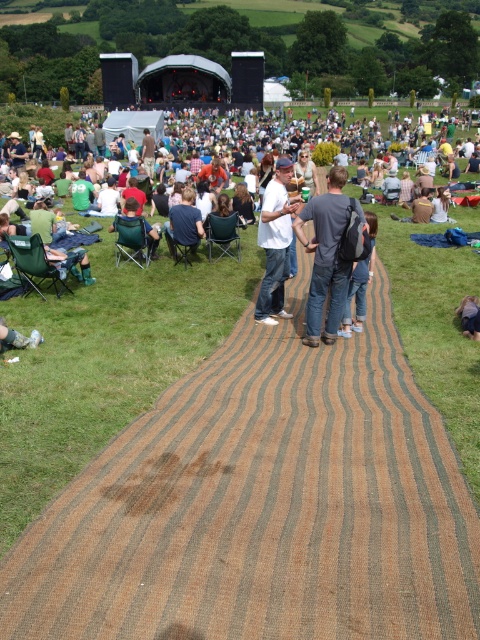
Question: Which point is farther to the camera?

Choices:
 (A) dark blue jeans at center
 (B) dark gray backpack at center

Answer: (A)

Question: Is dark gray backpack at center above white cotton shirt at center?

Choices:
 (A) yes
 (B) no

Answer: (B)

Question: Which object is the farthest from the white cotton shirt at center?

Choices:
 (A) dark blue jeans at center
 (B) denim jeans at center
 (C) dark green fabric chair at center
 (D) dark gray backpack at center

Answer: (C)

Question: Which of the following is the farthest from the observer?

Choices:
 (A) dark blue shirt at center
 (B) dark blue jeans at center

Answer: (A)

Question: Can you confirm if brown striped carpet at center is positioned to the left of dark blue jeans at center?

Choices:
 (A) yes
 (B) no

Answer: (A)

Question: Considering the relative positions of dark blue shirt at center and dark green fabric chair at center in the image provided, where is dark blue shirt at center located with respect to dark green fabric chair at center?

Choices:
 (A) right
 (B) left

Answer: (A)